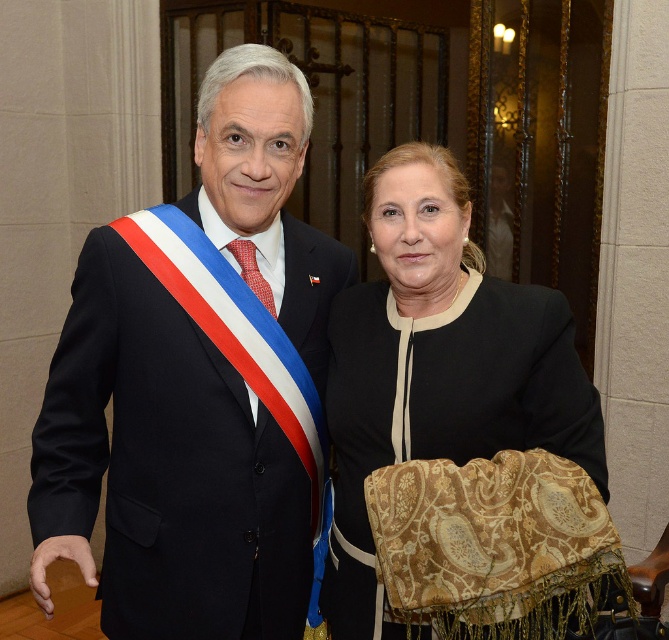
Looking at this image, you are a photographer setting up for a group photo. You need to ensure there is enough space between the matte black suit at left and the matte black jacket at center for a small microphone stand that requires 12 inches of space. Based on the image, will the stand fit between them?

The distance between the matte black suit at left and the matte black jacket at center is 11.59 inches, which is slightly less than the required 12 inches. Therefore, the microphone stand will not fit between them.